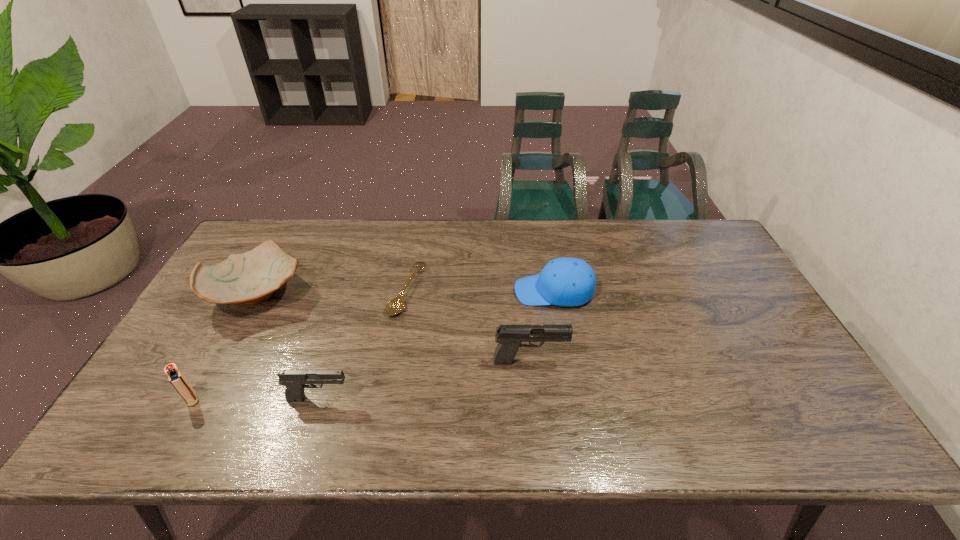
The height and width of the screenshot is (540, 960). I want to click on the shorter pistol, so click(x=295, y=381).

This screenshot has height=540, width=960. Identify the location of the left pistol. (295, 381).

This screenshot has width=960, height=540. In order to click on the taller pistol in this screenshot , I will do `click(509, 337)`.

Where is `the farther pistol`? This screenshot has height=540, width=960. the farther pistol is located at coordinates (509, 337).

Image resolution: width=960 pixels, height=540 pixels. Find the location of `pottery`. pottery is located at coordinates (252, 277).

Locate an element on the screen. This screenshot has width=960, height=540. the third object from right to left is located at coordinates (395, 306).

Find the location of a particular element. ladle is located at coordinates (395, 306).

Find the location of a particular element. cap is located at coordinates (565, 281).

The height and width of the screenshot is (540, 960). Identify the location of igniter. (176, 378).

At what (x,y) coordinates should I click in order to perform the action: click on vacant space located aim along the barrel of the fourth object from right to left. Please return your answer as a coordinate pair (x, y). The width and height of the screenshot is (960, 540). Looking at the image, I should click on (484, 398).